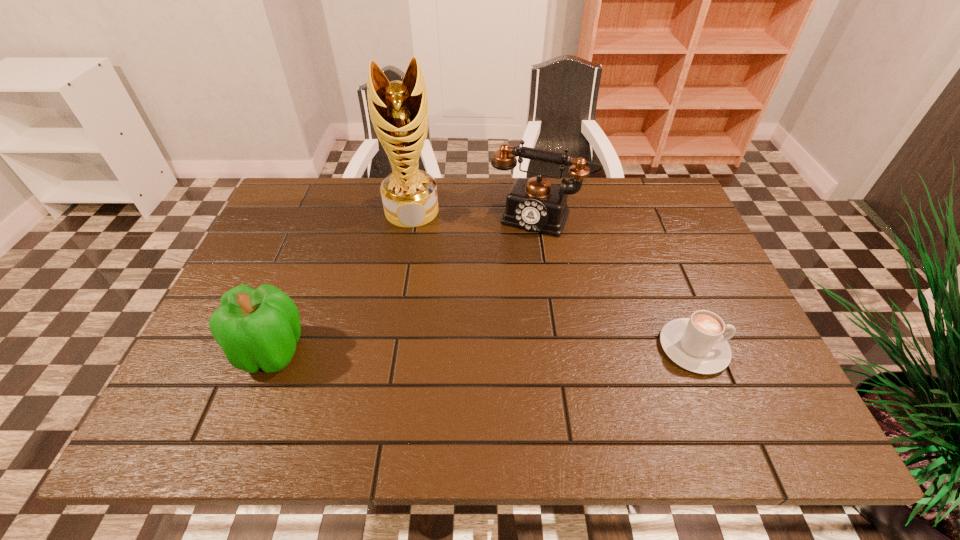
Locate an element on the screen. Image resolution: width=960 pixels, height=540 pixels. the leftmost object is located at coordinates (257, 328).

Image resolution: width=960 pixels, height=540 pixels. In order to click on the second shortest object in this screenshot , I will do `click(257, 328)`.

The width and height of the screenshot is (960, 540). In order to click on cappuccino in this screenshot , I will do pos(696,344).

The height and width of the screenshot is (540, 960). I want to click on the shortest object, so click(x=696, y=344).

Where is `the third object from left to right`? This screenshot has width=960, height=540. the third object from left to right is located at coordinates (534, 204).

Identify the location of the third shortest object. The height and width of the screenshot is (540, 960). (534, 204).

Locate an element on the screen. The width and height of the screenshot is (960, 540). the second object from left to right is located at coordinates (399, 111).

Identify the location of award. (399, 111).

The image size is (960, 540). Identify the location of vacant space located 0.340m on the right of the second shortest object. (466, 351).

Locate an element on the screen. The image size is (960, 540). vacant space located to the right of the rightmost object is located at coordinates (750, 348).